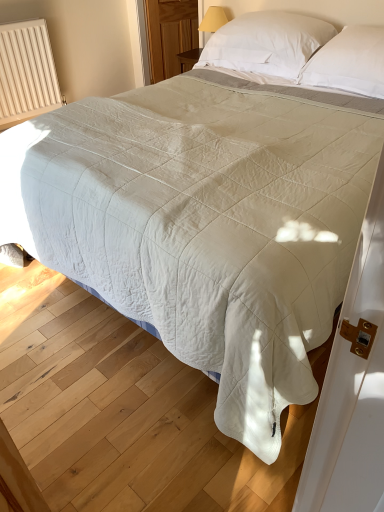
The width and height of the screenshot is (384, 512). Find the location of `white soft pillow at upper center, arranged as the 2th pillow when viewed from the right`. white soft pillow at upper center, arranged as the 2th pillow when viewed from the right is located at coordinates (267, 42).

You are a GUI agent. You are given a task and a screenshot of the screen. Output one action in this format:
    pyautogui.click(x=<x>, y=<y>)
    Task: Click on the white soft pillow at upper center, which appears as the 2th pillow when viewed from the left
    
    Given the screenshot: What is the action you would take?
    pyautogui.click(x=349, y=62)

From a real-world perspective, which is physically above, white soft pillow at upper center, positioned as the first pillow in right-to-left order, or transparent wooden door at upper center?

From a 3D spatial view, white soft pillow at upper center, positioned as the first pillow in right-to-left order, is above.

Is white soft pillow at upper center, which appears as the 2th pillow when viewed from the left, next to transparent wooden door at upper center and touching it?

No, white soft pillow at upper center, which appears as the 2th pillow when viewed from the left, is not making contact with transparent wooden door at upper center.

Does point (331, 80) appear closer or farther from the camera than point (160, 62)?

Clearly, point (331, 80) is closer to the camera than point (160, 62).

Which object is further away from the camera taking this photo, transparent wooden door at upper center or white soft pillow at upper center, arranged as the 2th pillow when viewed from the right?

Positioned behind is transparent wooden door at upper center.

Is transparent wooden door at upper center surrounding white soft pillow at upper center, arranged as the 2th pillow when viewed from the right?

No, white soft pillow at upper center, arranged as the 2th pillow when viewed from the right, is located outside of transparent wooden door at upper center.

Is transparent wooden door at upper center with white soft pillow at upper center, arranged as the 2th pillow when viewed from the right?

transparent wooden door at upper center and white soft pillow at upper center, arranged as the 2th pillow when viewed from the right, are clearly separated.

Is point (192, 5) closer or farther from the camera than point (241, 22)?

Point (192, 5) appears to be farther away from the viewer than point (241, 22).

Can you tell me how much beige ribbed radiator at left and transparent wooden door at upper center differ in facing direction?

The angle between the facing direction of beige ribbed radiator at left and the facing direction of transparent wooden door at upper center is 11.7 degrees.

Considering the sizes of objects beige ribbed radiator at left and transparent wooden door at upper center in the image provided, who is wider, beige ribbed radiator at left or transparent wooden door at upper center?

With larger width is beige ribbed radiator at left.

Looking at this image, considering the sizes of objects beige ribbed radiator at left and transparent wooden door at upper center in the image provided, who is bigger, beige ribbed radiator at left or transparent wooden door at upper center?

beige ribbed radiator at left is bigger.

How far apart are beige ribbed radiator at left and transparent wooden door at upper center?

A distance of 1.21 meters exists between beige ribbed radiator at left and transparent wooden door at upper center.

In the scene shown: Is beige ribbed radiator at left at the back of white soft pillow at upper center, which appears as the 2th pillow when viewed from the left?

No, white soft pillow at upper center, which appears as the 2th pillow when viewed from the left,'s orientation is not away from beige ribbed radiator at left.

From a real-world perspective, is white soft pillow at upper center, positioned as the first pillow in right-to-left order, physically located above or below beige ribbed radiator at left?

In terms of real-world spatial position, white soft pillow at upper center, positioned as the first pillow in right-to-left order, is above beige ribbed radiator at left.

Is white soft pillow at upper center, positioned as the first pillow in right-to-left order, not near beige ribbed radiator at left?

white soft pillow at upper center, positioned as the first pillow in right-to-left order, is far away from beige ribbed radiator at left.

From the image's perspective, which one is positioned higher, white soft pillow at upper center, positioned as the first pillow in right-to-left order, or beige ribbed radiator at left?

beige ribbed radiator at left.

From a real-world perspective, between beige ribbed radiator at left and white soft pillow at upper center, arranged as the 2th pillow when viewed from the right, who is vertically lower?

beige ribbed radiator at left.

Does beige ribbed radiator at left touch white soft pillow at upper center, arranged as the 2th pillow when viewed from the right?

beige ribbed radiator at left and white soft pillow at upper center, arranged as the 2th pillow when viewed from the right, are not in contact.

Where is `radiator behind the white soft pillow at upper center, arranged as the 2th pillow when viewed from the right`? The height and width of the screenshot is (512, 384). radiator behind the white soft pillow at upper center, arranged as the 2th pillow when viewed from the right is located at coordinates (26, 72).

Can you confirm if beige ribbed radiator at left is shorter than white soft pillow at upper center, acting as the first pillow starting from the left?

No, beige ribbed radiator at left is not shorter than white soft pillow at upper center, acting as the first pillow starting from the left.

From a real-world perspective, does transparent wooden door at upper center sit lower than white soft pillow at upper center, positioned as the first pillow in right-to-left order?

Yes, from a real-world perspective, transparent wooden door at upper center is beneath white soft pillow at upper center, positioned as the first pillow in right-to-left order.

This screenshot has height=512, width=384. There is a transparent wooden door at upper center. Identify the location of the 2nd pillow below it (from the image's perspective). (349, 62).

Would you say transparent wooden door at upper center is inside or outside white soft pillow at upper center, which appears as the 2th pillow when viewed from the left?

transparent wooden door at upper center is spatially situated outside white soft pillow at upper center, which appears as the 2th pillow when viewed from the left.

Does transparent wooden door at upper center have a lesser width compared to white soft pillow at upper center, which appears as the 2th pillow when viewed from the left?

Yes, transparent wooden door at upper center is thinner than white soft pillow at upper center, which appears as the 2th pillow when viewed from the left.

Is beige ribbed radiator at left surrounded by transparent wooden door at upper center?

No, transparent wooden door at upper center does not contain beige ribbed radiator at left.

Consider the image. Which of these two, transparent wooden door at upper center or beige ribbed radiator at left, is smaller?

Smaller between the two is transparent wooden door at upper center.

This screenshot has width=384, height=512. I want to click on radiator that is on the left side of transparent wooden door at upper center, so click(x=26, y=72).

You are a GUI agent. You are given a task and a screenshot of the screen. Output one action in this format:
    pyautogui.click(x=<x>, y=<y>)
    Task: Click on the glass door on the left of white soft pillow at upper center, positioned as the first pillow in right-to-left order
    The width and height of the screenshot is (384, 512).
    Given the screenshot: What is the action you would take?
    pyautogui.click(x=169, y=35)

I want to click on the 2nd pillow above the transparent wooden door at upper center (from a real-world perspective), so click(x=267, y=42).

From the image, which object appears to be farther from white soft pillow at upper center, arranged as the 2th pillow when viewed from the right, transparent wooden door at upper center or white soft pillow at upper center, which appears as the 2th pillow when viewed from the left?

Based on the image, transparent wooden door at upper center appears to be further to white soft pillow at upper center, arranged as the 2th pillow when viewed from the right.

Based on the photo, which object lies nearer to the anchor point beige ribbed radiator at left, white soft pillow at upper center, positioned as the first pillow in right-to-left order, or white soft pillow at upper center, acting as the first pillow starting from the left?

white soft pillow at upper center, acting as the first pillow starting from the left.

Based on the photo, looking at the image, which one is located further to white soft pillow at upper center, acting as the first pillow starting from the left, white soft pillow at upper center, positioned as the first pillow in right-to-left order, or transparent wooden door at upper center?

transparent wooden door at upper center lies further to white soft pillow at upper center, acting as the first pillow starting from the left, than the other object.

Looking at the image, which one is located further to transparent wooden door at upper center, white soft pillow at upper center, which appears as the 2th pillow when viewed from the left, or white soft pillow at upper center, acting as the first pillow starting from the left?

Among the two, white soft pillow at upper center, which appears as the 2th pillow when viewed from the left, is located further to transparent wooden door at upper center.

When comparing their distances from white soft pillow at upper center, positioned as the first pillow in right-to-left order, does transparent wooden door at upper center or beige ribbed radiator at left seem closer?

transparent wooden door at upper center.

When comparing their distances from beige ribbed radiator at left, does white soft pillow at upper center, arranged as the 2th pillow when viewed from the right, or white soft pillow at upper center, which appears as the 2th pillow when viewed from the left, seem closer?

Among the two, white soft pillow at upper center, arranged as the 2th pillow when viewed from the right, is located nearer to beige ribbed radiator at left.

Based on their spatial positions, is white soft pillow at upper center, arranged as the 2th pillow when viewed from the right, or beige ribbed radiator at left further from transparent wooden door at upper center?

white soft pillow at upper center, arranged as the 2th pillow when viewed from the right.

Based on their spatial positions, is beige ribbed radiator at left or transparent wooden door at upper center further from white soft pillow at upper center, arranged as the 2th pillow when viewed from the right?

beige ribbed radiator at left.

Find the location of `pillow positioned between white soft pillow at upper center, positioned as the first pillow in right-to-left order, and transparent wooden door at upper center from near to far`. pillow positioned between white soft pillow at upper center, positioned as the first pillow in right-to-left order, and transparent wooden door at upper center from near to far is located at coordinates (267, 42).

Locate an element on the screen. This screenshot has height=512, width=384. glass door between beige ribbed radiator at left and white soft pillow at upper center, which appears as the 2th pillow when viewed from the left is located at coordinates (169, 35).

You are a GUI agent. You are given a task and a screenshot of the screen. Output one action in this format:
    pyautogui.click(x=<x>, y=<y>)
    Task: Click on the pillow situated between beige ribbed radiator at left and white soft pillow at upper center, which appears as the 2th pillow when viewed from the left, from left to right
    This screenshot has height=512, width=384.
    Given the screenshot: What is the action you would take?
    pyautogui.click(x=267, y=42)

You are a GUI agent. You are given a task and a screenshot of the screen. Output one action in this format:
    pyautogui.click(x=<x>, y=<y>)
    Task: Click on the glass door between beige ribbed radiator at left and white soft pillow at upper center, arranged as the 2th pillow when viewed from the right
    The height and width of the screenshot is (512, 384).
    Given the screenshot: What is the action you would take?
    pyautogui.click(x=169, y=35)